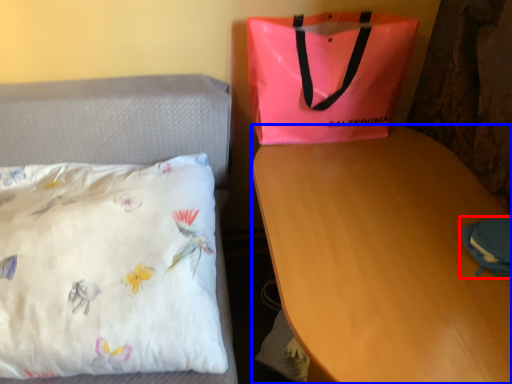
Question: Which point is closer to the camera, pouch (highlighted by a red box) or desk (highlighted by a blue box)?

Choices:
 (A) pouch
 (B) desk

Answer: (B)